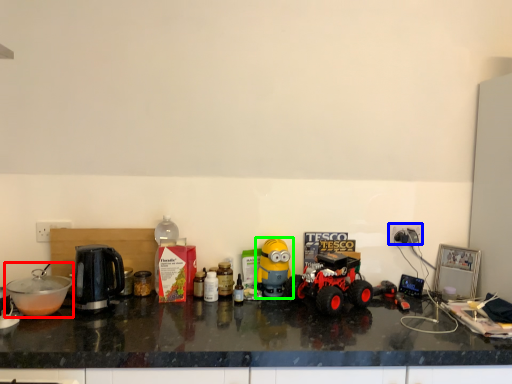
Question: Considering the real-world distances, which object is closest to appliance (highlighted by a red box)? power outlet (highlighted by a blue box) or toy (highlighted by a green box).

Choices:
 (A) power outlet
 (B) toy

Answer: (B)